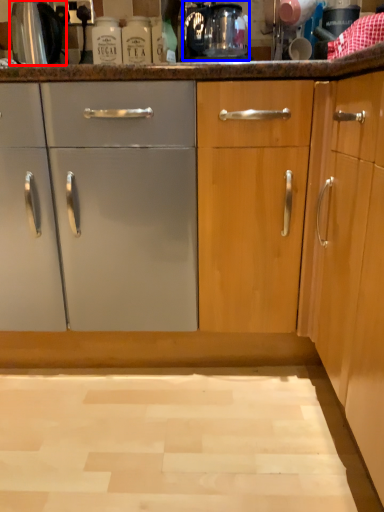
Question: Which point is closer to the camera, appliance (highlighted by a red box) or coffee machine (highlighted by a blue box)?

Choices:
 (A) appliance
 (B) coffee machine

Answer: (B)